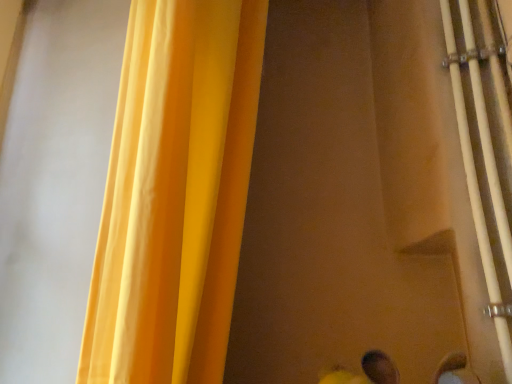
What do you see at coordinates (175, 193) in the screenshot?
I see `matte yellow curtain at left` at bounding box center [175, 193].

Identify the location of matte yellow curtain at left. This screenshot has height=384, width=512. [x=175, y=193].

What is the approximate width of matte yellow curtain at left?

matte yellow curtain at left is 29.85 centimeters wide.

The image size is (512, 384). In order to click on matte yellow curtain at left in this screenshot , I will do `click(175, 193)`.